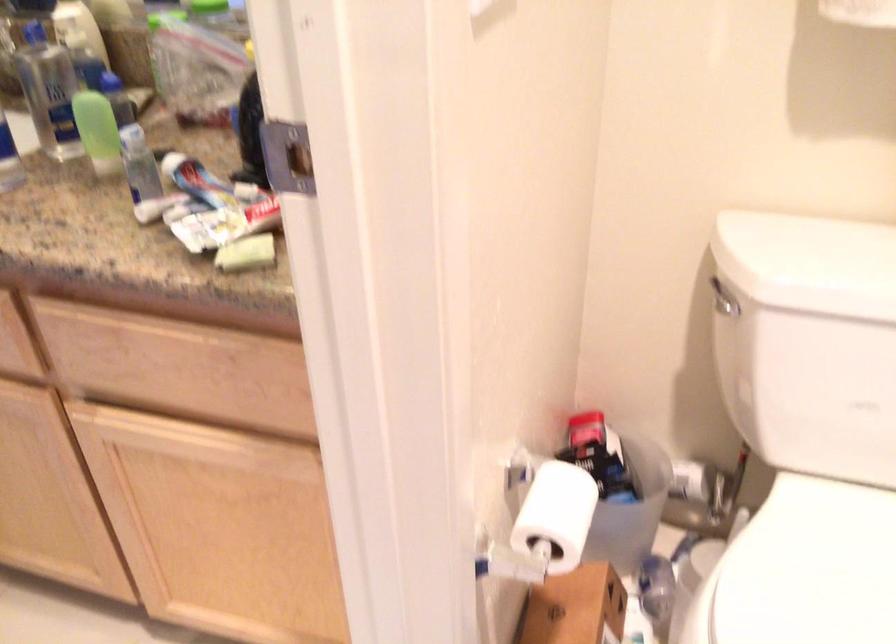
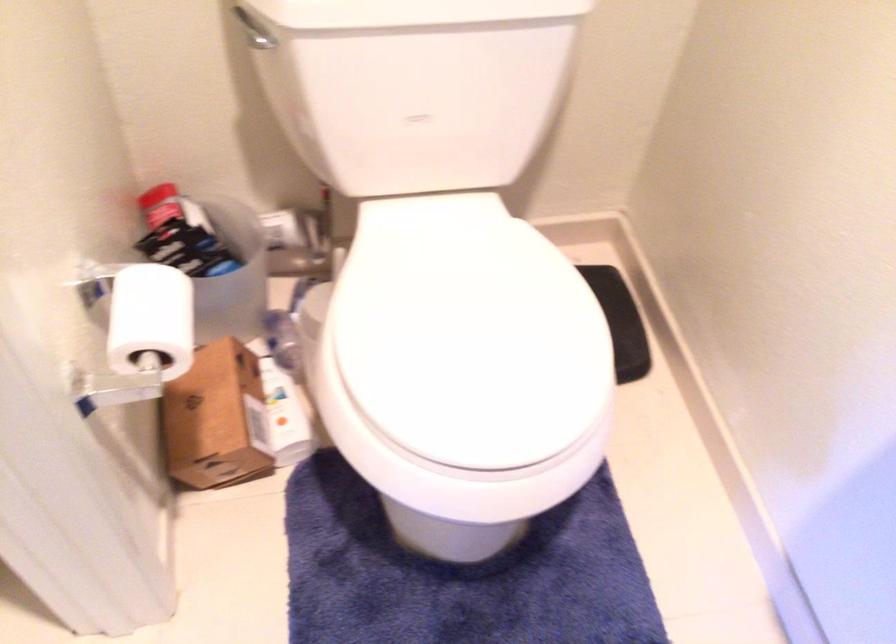
Find the pixel in the second image that matches [550,509] in the first image.

(151, 319)